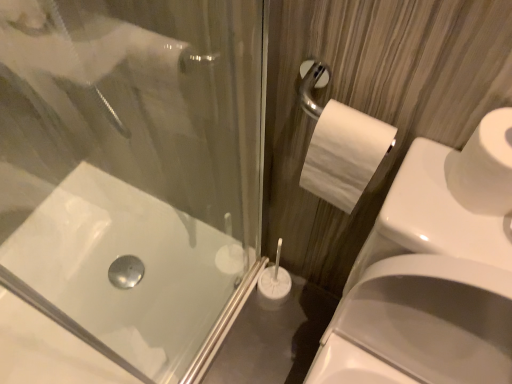
Question: Does white matte toilet paper at right, the 2th toilet paper positioned from the left, have a smaller size compared to white glossy bath at lower left?

Choices:
 (A) no
 (B) yes

Answer: (B)

Question: From a real-world perspective, is white matte toilet paper at right, the 1th toilet paper in the right-to-left sequence, below white glossy bath at lower left?

Choices:
 (A) yes
 (B) no

Answer: (B)

Question: Is white matte toilet paper at right, the 1th toilet paper in the right-to-left sequence, to the right of white glossy bath at lower left from the viewer's perspective?

Choices:
 (A) yes
 (B) no

Answer: (A)

Question: Does white matte toilet paper at right, the 1th toilet paper in the right-to-left sequence, have a larger size compared to white glossy bath at lower left?

Choices:
 (A) yes
 (B) no

Answer: (B)

Question: Can you confirm if white matte toilet paper at right, the 1th toilet paper in the right-to-left sequence, is shorter than white glossy bath at lower left?

Choices:
 (A) yes
 (B) no

Answer: (B)

Question: Is white glossy bath at lower left at the left side of white glossy sink at lower right?

Choices:
 (A) no
 (B) yes

Answer: (B)

Question: Can you confirm if white glossy bath at lower left is bigger than white glossy sink at lower right?

Choices:
 (A) no
 (B) yes

Answer: (A)

Question: Considering the relative sizes of white glossy bath at lower left and white glossy sink at lower right in the image provided, is white glossy bath at lower left taller than white glossy sink at lower right?

Choices:
 (A) yes
 (B) no

Answer: (B)

Question: Is white glossy bath at lower left oriented away from white glossy sink at lower right?

Choices:
 (A) no
 (B) yes

Answer: (A)

Question: From a real-world perspective, is white glossy bath at lower left over white glossy sink at lower right?

Choices:
 (A) yes
 (B) no

Answer: (B)

Question: From the image's perspective, would you say white glossy bath at lower left is positioned over white glossy sink at lower right?

Choices:
 (A) no
 (B) yes

Answer: (A)

Question: Is the depth of white matte toilet paper at right, which is counted as the 1th toilet paper, starting from the left, greater than that of white glossy bath at lower left?

Choices:
 (A) no
 (B) yes

Answer: (A)